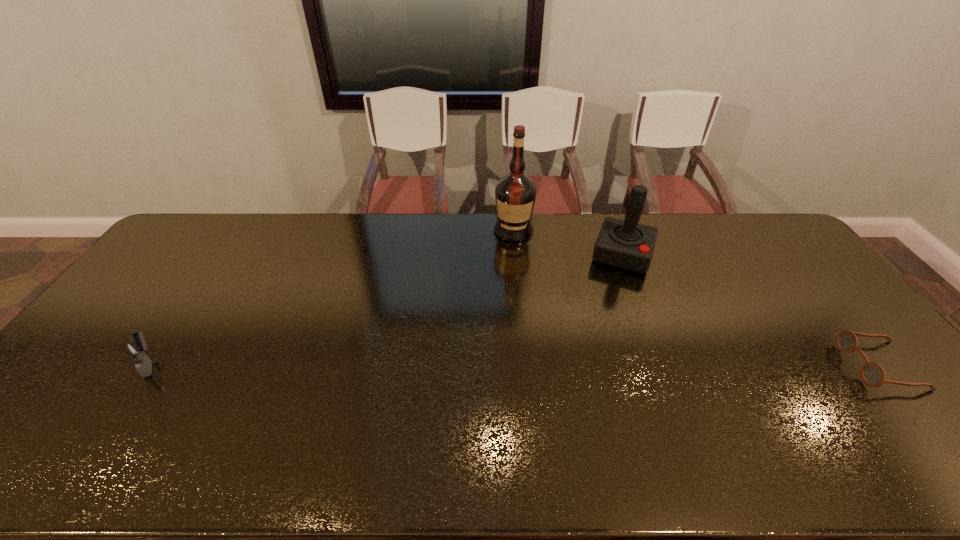
Find the location of `unoccupied area between the spectacles and the third object from left to right`. unoccupied area between the spectacles and the third object from left to right is located at coordinates (752, 310).

The image size is (960, 540). I want to click on free spot between the tallest object and the leftmost object, so click(x=332, y=297).

Where is `free area in between the second object from right to left and the rightmost object`? The height and width of the screenshot is (540, 960). free area in between the second object from right to left and the rightmost object is located at coordinates (752, 310).

What are the coordinates of `free spot between the third object from left to right and the leftmost object` in the screenshot? It's located at click(386, 308).

This screenshot has height=540, width=960. I want to click on free space between the spectacles and the tallest object, so click(x=697, y=298).

Identify the location of free space between the third tallest object and the second object from left to right. (332, 297).

Where is `unoccupied area between the shortest object and the second object from left to right`? unoccupied area between the shortest object and the second object from left to right is located at coordinates (697, 298).

Choose which object is the nearest neighbor to the third object from left to right. Please provide its 2D coordinates. Your answer should be formatted as a tuple, i.e. [(x, y)], where the tuple contains the x and y coordinates of a point satisfying the conditions above.

[(515, 194)]

Identify which object is located as the second nearest to the leftmost object. Please provide its 2D coordinates. Your answer should be formatted as a tuple, i.e. [(x, y)], where the tuple contains the x and y coordinates of a point satisfying the conditions above.

[(626, 244)]

Image resolution: width=960 pixels, height=540 pixels. I want to click on free space that satisfies the following two spatial constraints: 1. on the front side of the second object from right to left; 2. on the right side of the liquor, so click(516, 254).